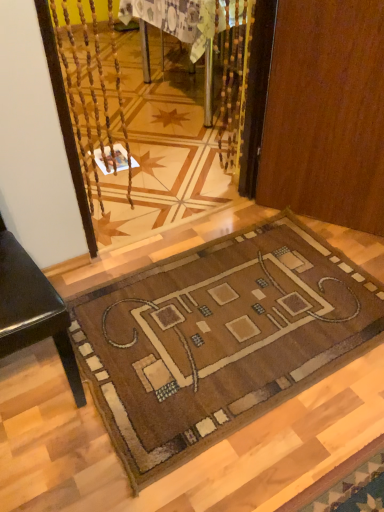
Question: Is wooden table at center to the right of brown wood door at center from the viewer's perspective?

Choices:
 (A) yes
 (B) no

Answer: (B)

Question: Does wooden table at center have a lesser height compared to brown wood door at center?

Choices:
 (A) yes
 (B) no

Answer: (A)

Question: Is wooden table at center smaller than brown wood door at center?

Choices:
 (A) yes
 (B) no

Answer: (B)

Question: From a real-world perspective, is wooden table at center beneath brown wood door at center?

Choices:
 (A) yes
 (B) no

Answer: (A)

Question: Is wooden table at center taller than brown wood door at center?

Choices:
 (A) yes
 (B) no

Answer: (B)

Question: Is wooden table at center completely or partially outside of brown wood door at center?

Choices:
 (A) no
 (B) yes

Answer: (B)

Question: Is brown wood door at center outside wooden table at center?

Choices:
 (A) no
 (B) yes

Answer: (B)

Question: From the image's perspective, does brown wood door at center appear lower than wooden table at center?

Choices:
 (A) no
 (B) yes

Answer: (B)

Question: Considering the relative sizes of brown wood door at center and wooden table at center in the image provided, is brown wood door at center smaller than wooden table at center?

Choices:
 (A) yes
 (B) no

Answer: (A)

Question: Is brown wood door at center further to the viewer compared to wooden table at center?

Choices:
 (A) yes
 (B) no

Answer: (B)

Question: From the image's perspective, is brown wood door at center on wooden table at center?

Choices:
 (A) yes
 (B) no

Answer: (B)

Question: Is the surface of brown wood door at center in direct contact with wooden table at center?

Choices:
 (A) yes
 (B) no

Answer: (B)

Question: Can you confirm if brown woven mat at lower center is smaller than wooden table at center?

Choices:
 (A) yes
 (B) no

Answer: (A)